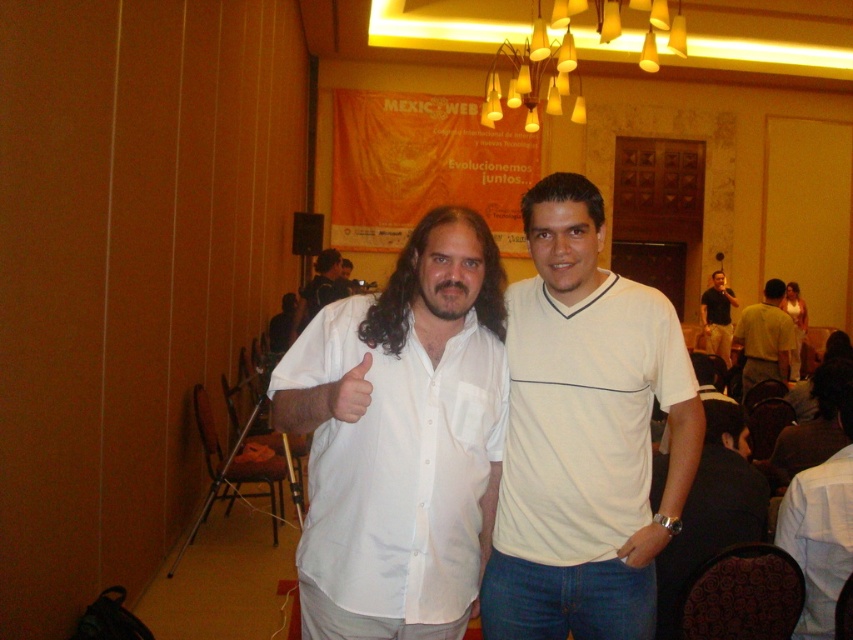
Question: Which of these objects is positioned farthest from the white shirt at center?

Choices:
 (A) white cotton shirt at center
 (B) white button-down shirt at center
 (C) yellow cotton shirt at center
 (D) dark brown leather shirt at center

Answer: (B)

Question: Can you confirm if white cotton t-shirt at center is positioned above dark brown leather shirt at center?

Choices:
 (A) no
 (B) yes

Answer: (A)

Question: Which point appears farthest from the camera in this image?

Choices:
 (A) (709, 312)
 (B) (363, 541)
 (C) (306, 291)

Answer: (A)

Question: Does white cotton shirt at center appear under yellow cotton shirt at center?

Choices:
 (A) yes
 (B) no

Answer: (A)

Question: Does white button-down shirt at center come behind white cotton shirt at center?

Choices:
 (A) no
 (B) yes

Answer: (A)

Question: Which point appears farthest from the camera in this image?

Choices:
 (A) (425, 476)
 (B) (339, 269)
 (C) (676, 522)

Answer: (B)